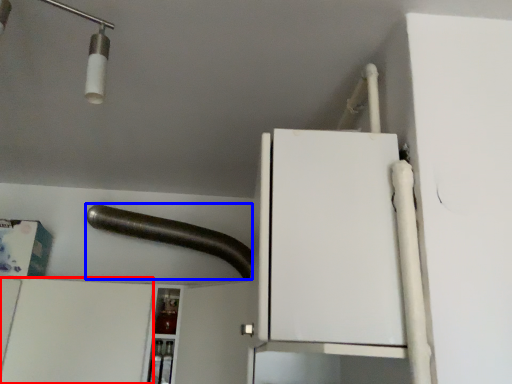
Question: Among these objects, which one is nearest to the camera, cabinetry (highlighted by a red box) or beam (highlighted by a blue box)?

Choices:
 (A) cabinetry
 (B) beam

Answer: (A)